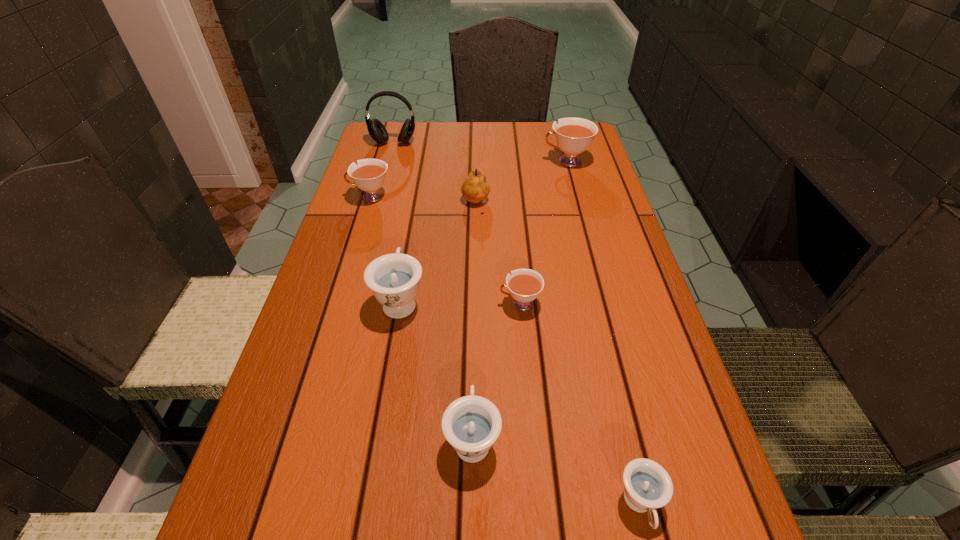
I want to click on vacant space located on the side of the leftmost blue teacup with the handle, so click(x=420, y=191).

At what (x,y) coordinates should I click in order to perform the action: click on vacant area located on the right of the pear. Please return your answer as a coordinate pair (x, y). Looking at the image, I should click on (541, 204).

Find the location of a particular element. free location located on the side of the second blue teacup from left to right with the handle is located at coordinates (474, 259).

Identify the location of vacant point located 0.250m on the side of the second blue teacup from left to right with the handle. This screenshot has width=960, height=540. (474, 300).

This screenshot has height=540, width=960. What are the coordinates of `vacant space located 0.180m on the side of the second blue teacup from left to right with the handle` in the screenshot? It's located at (474, 325).

Locate an element on the screen. This screenshot has width=960, height=540. free space located 0.070m on the side of the nearest white teacup with the handle is located at coordinates pyautogui.click(x=467, y=303).

I want to click on blank space located on the side of the nearest white teacup with the handle, so [x=336, y=303].

Locate an element on the screen. The image size is (960, 540). vacant space located on the side of the nearest white teacup with the handle is located at coordinates (401, 303).

The image size is (960, 540). What are the coordinates of `headset that is at the far edge` in the screenshot? It's located at (377, 131).

The height and width of the screenshot is (540, 960). Identify the location of teacup positioned at the far edge. (573, 135).